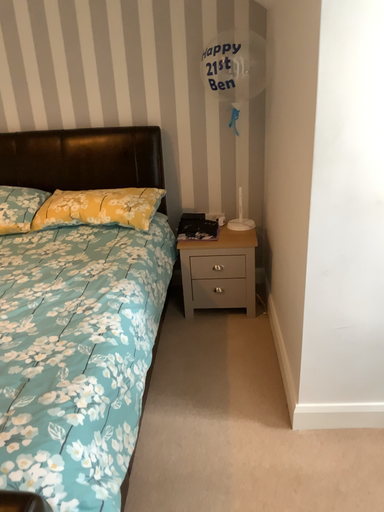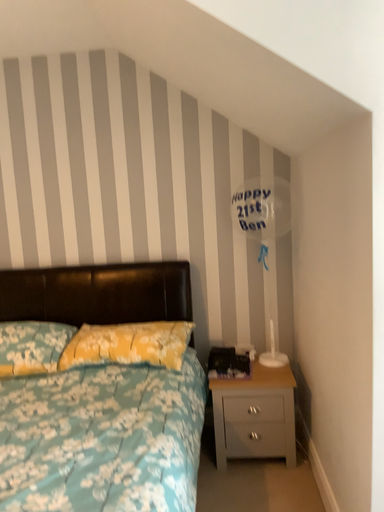
Question: How did the camera likely rotate when shooting the video?

Choices:
 (A) rotated upward
 (B) rotated downward

Answer: (A)